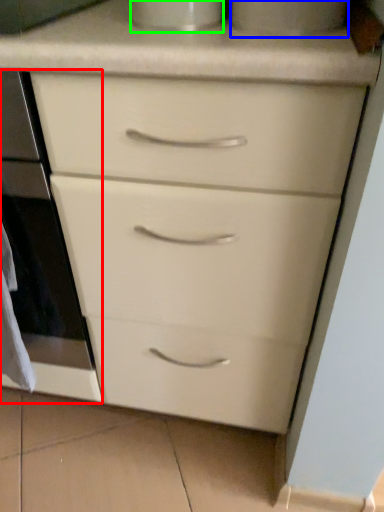
Question: Which is farther away from oven (highlighted by a red box)? appliance (highlighted by a blue box) or appliance (highlighted by a green box)?

Choices:
 (A) appliance
 (B) appliance

Answer: (A)